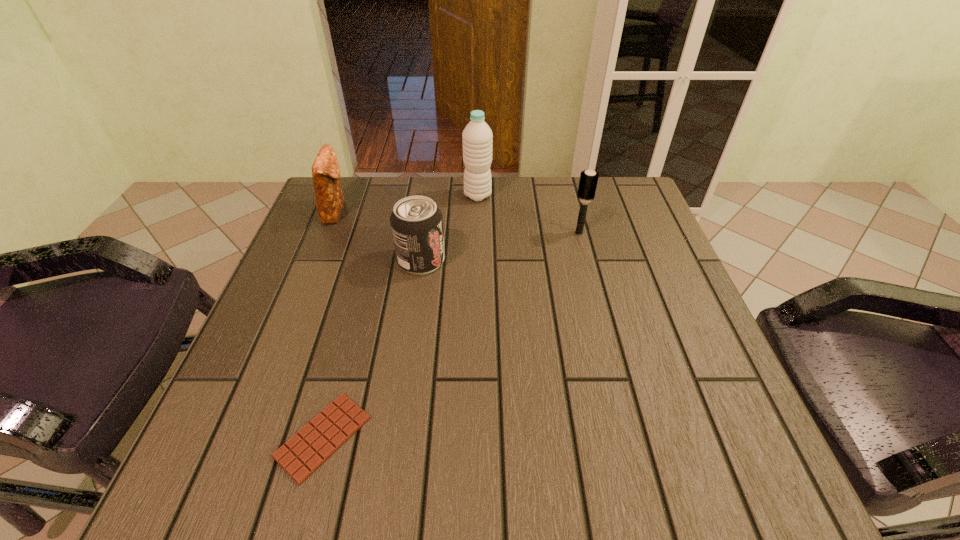
This screenshot has height=540, width=960. I want to click on vacant space located on the open side of the leftmost object, so click(425, 211).

Where is `free space located on the right of the soda can`? This screenshot has width=960, height=540. free space located on the right of the soda can is located at coordinates (493, 260).

Find the location of `vacant space located on the right of the nearest object`. vacant space located on the right of the nearest object is located at coordinates (599, 437).

In order to click on water bottle positioned at the far edge in this screenshot , I will do `click(477, 136)`.

Where is `hairbrush positioned at the far edge`? The image size is (960, 540). hairbrush positioned at the far edge is located at coordinates (588, 181).

Locate an element on the screen. The height and width of the screenshot is (540, 960). clutch bag positioned at the far edge is located at coordinates (329, 197).

Find the location of a particular element. The height and width of the screenshot is (540, 960). object that is at the near edge is located at coordinates [x=317, y=441].

The height and width of the screenshot is (540, 960). Identify the location of clutch bag at the left edge. (329, 197).

You are a GUI agent. You are given a task and a screenshot of the screen. Output one action in this format:
    pyautogui.click(x=<x>, y=<y>)
    Task: Click on the candy bar that is positioned at the left edge
    This screenshot has height=540, width=960.
    Given the screenshot: What is the action you would take?
    pyautogui.click(x=317, y=441)

This screenshot has width=960, height=540. Identify the location of object located at the far left corner. (329, 197).